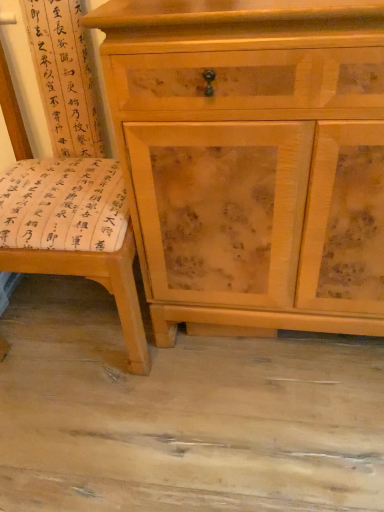
Image resolution: width=384 pixels, height=512 pixels. Describe the element at coordinates (100, 283) in the screenshot. I see `wooden swivel chair at left` at that location.

What are the coordinates of `wooden swivel chair at left` in the screenshot? It's located at (100, 283).

What is the approximate width of wooden swivel chair at left?

The width of wooden swivel chair at left is 23.04 inches.

The width and height of the screenshot is (384, 512). Describe the element at coordinates (252, 160) in the screenshot. I see `light wood cabinet at center` at that location.

Measure the distance between light wood cabinet at center and camera.

light wood cabinet at center is 24.48 inches from camera.

Identify the location of light wood cabinet at center. The height and width of the screenshot is (512, 384). (252, 160).

Image resolution: width=384 pixels, height=512 pixels. Find the location of `wooden swivel chair at left`. wooden swivel chair at left is located at coordinates (100, 283).

Is wooden swivel chair at left at the left side of light wood cabinet at center?

Yes, wooden swivel chair at left is to the left of light wood cabinet at center.

Is wooden swivel chair at left behind light wood cabinet at center?

No.

Is point (130, 237) positioned behind point (342, 324)?

No, (130, 237) is in front of (342, 324).

From the image's perspective, is wooden swivel chair at left below light wood cabinet at center?

Yes, from the image's perspective, wooden swivel chair at left is beneath light wood cabinet at center.

From a real-world perspective, which object stands above the other?

wooden swivel chair at left is physically above.

Is wooden swivel chair at left wider than light wood cabinet at center?

Correct, the width of wooden swivel chair at left exceeds that of light wood cabinet at center.

Based on the photo, considering the relative sizes of wooden swivel chair at left and light wood cabinet at center in the image provided, is wooden swivel chair at left shorter than light wood cabinet at center?

In fact, wooden swivel chair at left may be taller than light wood cabinet at center.

Between wooden swivel chair at left and light wood cabinet at center, which one has smaller size?

wooden swivel chair at left is smaller.

Choose the correct answer: Is wooden swivel chair at left inside light wood cabinet at center or outside it?

wooden swivel chair at left exists outside the volume of light wood cabinet at center.

Is wooden swivel chair at left directly adjacent to light wood cabinet at center?

No, wooden swivel chair at left is not next to light wood cabinet at center.

Is wooden swivel chair at left facing towards light wood cabinet at center?

No, wooden swivel chair at left is not oriented towards light wood cabinet at center.

How different are the orientations of wooden swivel chair at left and light wood cabinet at center in degrees?

0.38 degrees.

From the picture: How much distance is there between wooden swivel chair at left and light wood cabinet at center?

They are 32.91 centimeters apart.

I want to click on swivel chair above the light wood cabinet at center (from a real-world perspective), so click(x=100, y=283).

Considering the relative positions of light wood cabinet at center and wooden swivel chair at left in the image provided, is light wood cabinet at center to the left or to the right of wooden swivel chair at left?

Based on their positions, light wood cabinet at center is located to the right of wooden swivel chair at left.

Is the position of light wood cabinet at center less distant than that of wooden swivel chair at left?

That is False.

Is point (223, 306) less distant than point (150, 360)?

Yes, point (223, 306) is closer to viewer.

From the image's perspective, would you say light wood cabinet at center is positioned over wooden swivel chair at left?

Correct, light wood cabinet at center appears higher than wooden swivel chair at left in the image.

From a real-world perspective, does light wood cabinet at center stand above wooden swivel chair at left?

Actually, light wood cabinet at center is physically below wooden swivel chair at left in the real world.

Which of these two, light wood cabinet at center or wooden swivel chair at left, is thinner?

Thinner between the two is light wood cabinet at center.

Who is shorter, light wood cabinet at center or wooden swivel chair at left?

Standing shorter between the two is light wood cabinet at center.

Considering the relative sizes of light wood cabinet at center and wooden swivel chair at left in the image provided, is light wood cabinet at center bigger than wooden swivel chair at left?

Correct, light wood cabinet at center is larger in size than wooden swivel chair at left.

Is light wood cabinet at center inside or outside of wooden swivel chair at left?

light wood cabinet at center is located beyond the bounds of wooden swivel chair at left.

Is light wood cabinet at center not close to wooden swivel chair at left?

No, there isn't a large distance between light wood cabinet at center and wooden swivel chair at left.

Is light wood cabinet at center looking in the opposite direction of wooden swivel chair at left?

light wood cabinet at center does not have its back to wooden swivel chair at left.

Based on the photo, measure the distance between light wood cabinet at center and wooden swivel chair at left.

32.91 centimeters.

You are a GUI agent. You are given a task and a screenshot of the screen. Output one action in this format:
    pyautogui.click(x=<x>, y=<y>)
    Task: Click on the swivel chair in front of the light wood cabinet at center
    The height and width of the screenshot is (512, 384).
    Given the screenshot: What is the action you would take?
    pyautogui.click(x=100, y=283)

You are a GUI agent. You are given a task and a screenshot of the screen. Output one action in this format:
    pyautogui.click(x=<x>, y=<y>)
    Task: Click on the chest of drawers on the right of wooden swivel chair at left
    The height and width of the screenshot is (512, 384).
    Given the screenshot: What is the action you would take?
    pyautogui.click(x=252, y=160)

Locate an element on the screen. The width and height of the screenshot is (384, 512). swivel chair in front of the light wood cabinet at center is located at coordinates (100, 283).